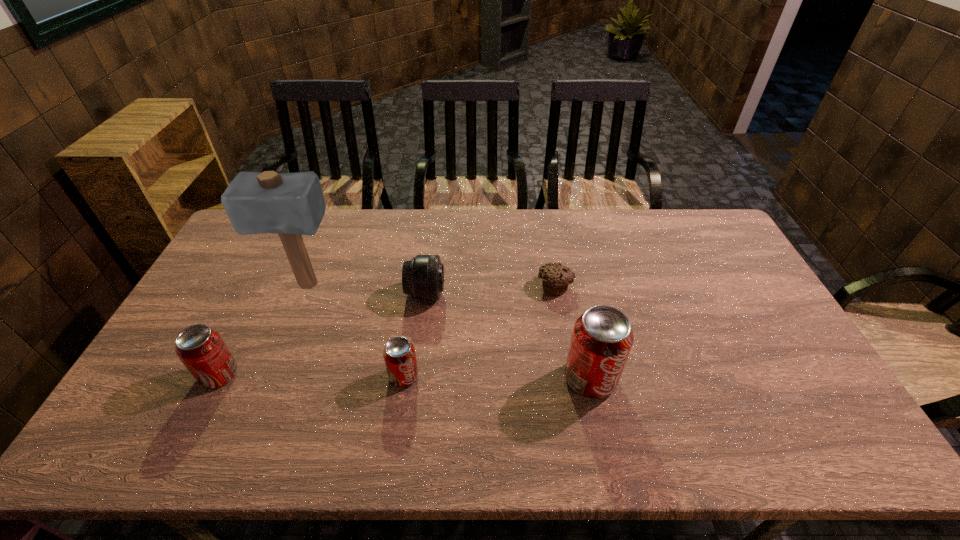
Select which object is the fifth closest to the leftmost soda can. Please provide its 2D coordinates. Your answer should be formatted as a tuple, i.e. [(x, y)], where the tuple contains the x and y coordinates of a point satisfying the conditions above.

[(602, 338)]

Where is `object that is the third closest to the rightmost soda can`? The height and width of the screenshot is (540, 960). object that is the third closest to the rightmost soda can is located at coordinates (399, 354).

Choose which soda can is the second nearest neighbor to the leftmost soda can. Please provide its 2D coordinates. Your answer should be formatted as a tuple, i.e. [(x, y)], where the tuple contains the x and y coordinates of a point satisfying the conditions above.

[(602, 338)]

What are the coordinates of `soda can identified as the closest to the telephoto lens` in the screenshot? It's located at (399, 354).